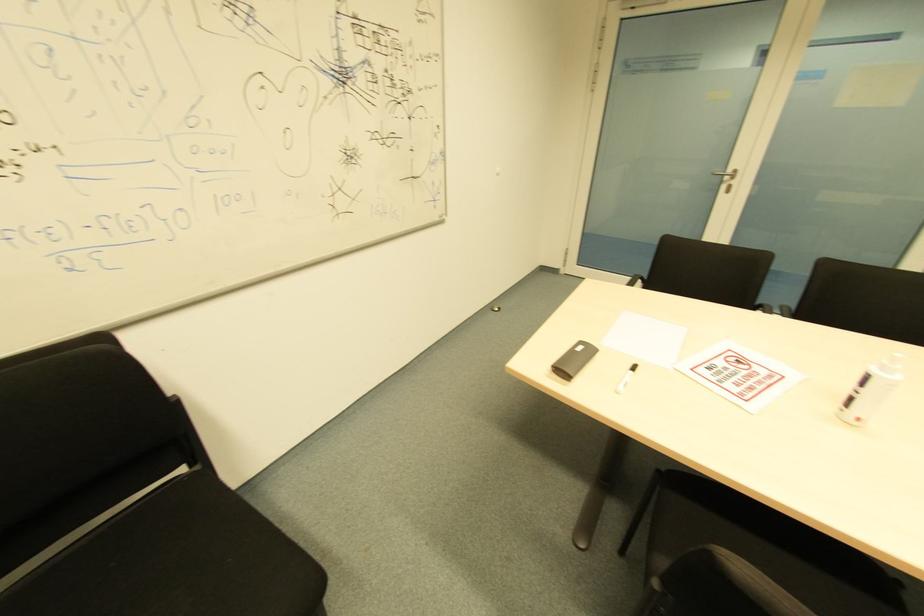
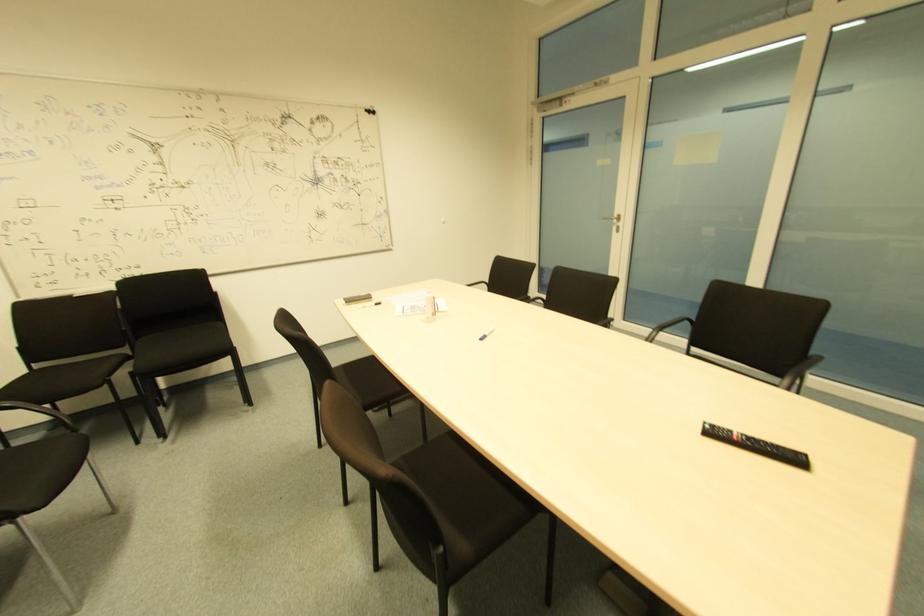
Find the pixel in the second image that matches point 732,184 in the first image.

(618, 227)